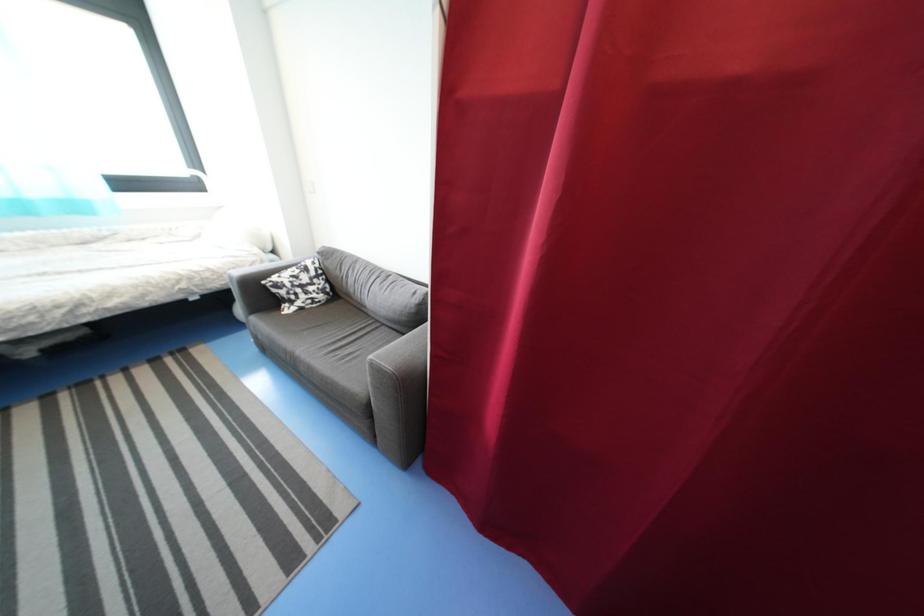
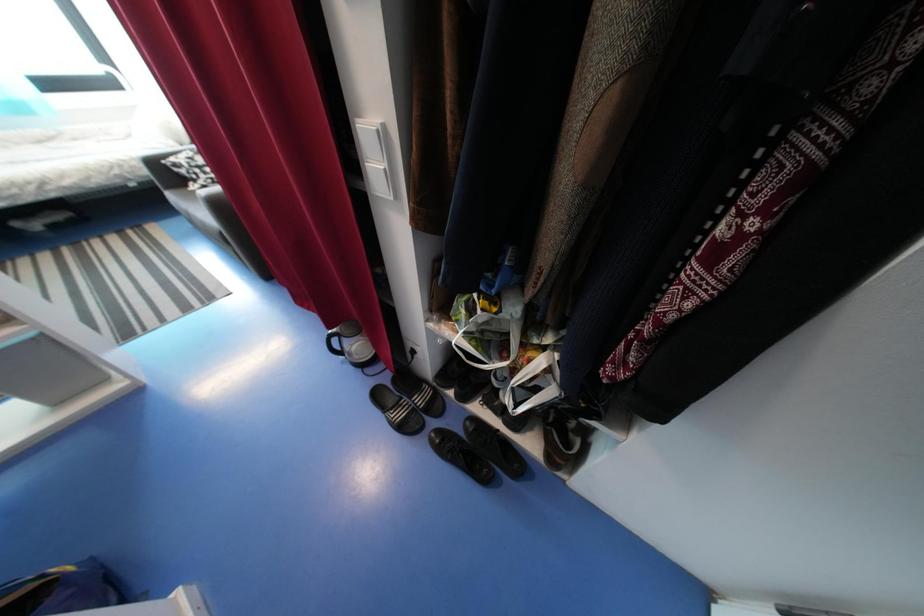
The images are taken continuously from a first-person perspective. In which direction are you moving?

The cameraman walked toward right, backward.